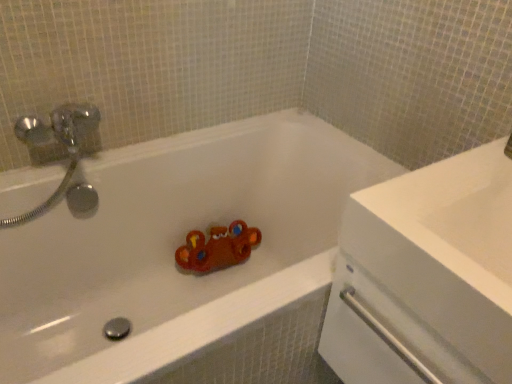
The height and width of the screenshot is (384, 512). What do you see at coordinates (446, 249) in the screenshot? I see `white glossy sink at upper right` at bounding box center [446, 249].

You are a GUI agent. You are given a task and a screenshot of the screen. Output one action in this format:
    pyautogui.click(x=<x>, y=<y>)
    Task: Click on the white glossy sink at upper right
    Image resolution: width=512 pixels, height=384 pixels.
    Given the screenshot: What is the action you would take?
    pyautogui.click(x=446, y=249)

Find the location of a particular element. This screenshot has width=512, height=384. white glossy bathtub at center is located at coordinates (175, 246).

The width and height of the screenshot is (512, 384). Describe the element at coordinates (175, 246) in the screenshot. I see `white glossy bathtub at center` at that location.

This screenshot has height=384, width=512. In order to click on white glossy sink at upper right in this screenshot , I will do `click(446, 249)`.

Considering the relative positions of white glossy sink at upper right and white glossy bathtub at center in the image provided, is white glossy sink at upper right to the left of white glossy bathtub at center from the viewer's perspective?

No.

Which object is more forward, white glossy sink at upper right or white glossy bathtub at center?

white glossy sink at upper right is in front.

Is point (464, 236) farther from camera compared to point (294, 139)?

No, it is not.

From the image's perspective, between white glossy sink at upper right and white glossy bathtub at center, which one is located above?

white glossy sink at upper right, from the image's perspective.

From a real-world perspective, is white glossy sink at upper right located beneath white glossy bathtub at center?

Incorrect, from a real-world perspective, white glossy sink at upper right is higher than white glossy bathtub at center.

Which of these two, white glossy sink at upper right or white glossy bathtub at center, is wider?

Wider between the two is white glossy bathtub at center.

Based on the photo, considering the relative sizes of white glossy sink at upper right and white glossy bathtub at center in the image provided, is white glossy sink at upper right taller than white glossy bathtub at center?

In fact, white glossy sink at upper right may be shorter than white glossy bathtub at center.

Between white glossy sink at upper right and white glossy bathtub at center, which one has larger size?

Bigger between the two is white glossy bathtub at center.

Would you say white glossy sink at upper right is inside or outside white glossy bathtub at center?

white glossy sink at upper right is spatially situated outside white glossy bathtub at center.

Is white glossy sink at upper right directly adjacent to white glossy bathtub at center?

white glossy sink at upper right and white glossy bathtub at center are clearly separated.

Consider the image. Could you tell me if white glossy sink at upper right is facing white glossy bathtub at center?

No, white glossy sink at upper right is not facing towards white glossy bathtub at center.

Find the location of a particular element. The image size is (512, 384). bathtub lying behind the white glossy sink at upper right is located at coordinates (175, 246).

Which object is positioned more to the right, white glossy bathtub at center or white glossy sink at upper right?

Positioned to the right is white glossy sink at upper right.

Considering the relative positions of white glossy bathtub at center and white glossy sink at upper right in the image provided, is white glossy bathtub at center in front of white glossy sink at upper right?

No.

Does point (249, 195) come behind point (471, 273)?

Yes, it is behind point (471, 273).

From the image's perspective, relative to white glossy sink at upper right, is white glossy bathtub at center above or below?

Based on their image positions, white glossy bathtub at center is located beneath white glossy sink at upper right.

From a real-world perspective, which object stands above the other?

white glossy sink at upper right.

Which object is thinner, white glossy bathtub at center or white glossy sink at upper right?

white glossy sink at upper right is thinner.

From their relative heights in the image, would you say white glossy bathtub at center is taller or shorter than white glossy sink at upper right?

Considering their sizes, white glossy bathtub at center has more height than white glossy sink at upper right.

Is white glossy bathtub at center bigger or smaller than white glossy sink at upper right?

white glossy bathtub at center is bigger than white glossy sink at upper right.

Is white glossy bathtub at center positioned beyond the bounds of white glossy sink at upper right?

white glossy bathtub at center is positioned outside white glossy sink at upper right.

Is the surface of white glossy bathtub at center in direct contact with white glossy sink at upper right?

No, white glossy bathtub at center is not touching white glossy sink at upper right.

Is white glossy bathtub at center turned away from white glossy sink at upper right?

white glossy bathtub at center is not turned away from white glossy sink at upper right.

How different are the orientations of white glossy bathtub at center and white glossy sink at upper right in degrees?

89.8 degrees separate the facing orientations of white glossy bathtub at center and white glossy sink at upper right.

Find the location of `counter top in front of the white glossy bathtub at center`. counter top in front of the white glossy bathtub at center is located at coordinates [446, 249].

At what (x,y) coordinates should I click in order to perform the action: click on counter top above the white glossy bathtub at center (from a real-world perspective). Please return your answer as a coordinate pair (x, y). Image resolution: width=512 pixels, height=384 pixels. Looking at the image, I should click on (446, 249).

Where is `bathtub that is behind the white glossy sink at upper right`? bathtub that is behind the white glossy sink at upper right is located at coordinates (175, 246).